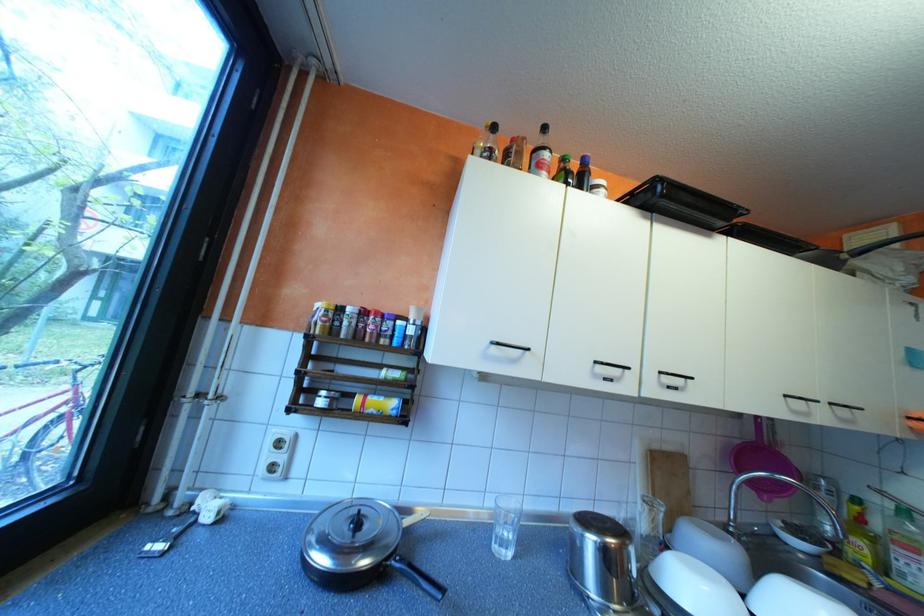
This screenshot has width=924, height=616. What are the coordinates of `faucet handle` in the screenshot? It's located at click(747, 530).